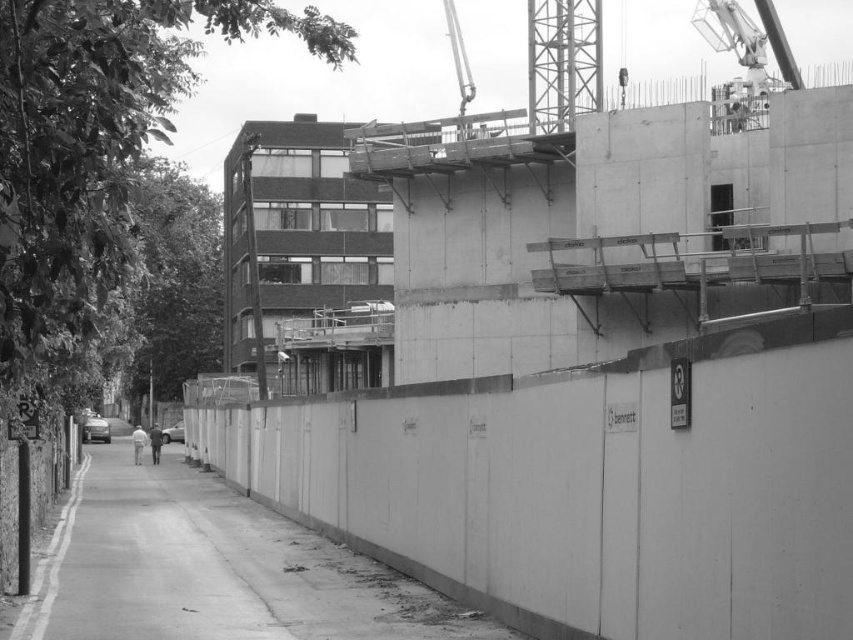
You are a delivery driver who needs to park your metallic silver car at center near the smooth concrete wall at center. The parking space is only 1.5 meters wide. Can your car fit into the space if the wall is wider than the car?

The smooth concrete wall at center is wider than the metallic silver car at center. Since the parking space is 1.5 meters wide, the car can fit as long as its width is less than or equal to 1.5 meters. However, the description only states the wall is wider than the car, not the car width itself. Without knowing the car width, it cannot be determined if it fits the space.

You are an architect reviewing a construction site plan. The blueprint shows a smooth concrete wall at center. According to the coordinates provided, where exactly is the smooth concrete wall located on the blueprint?

The smooth concrete wall at center is located at coordinates point (212,568).